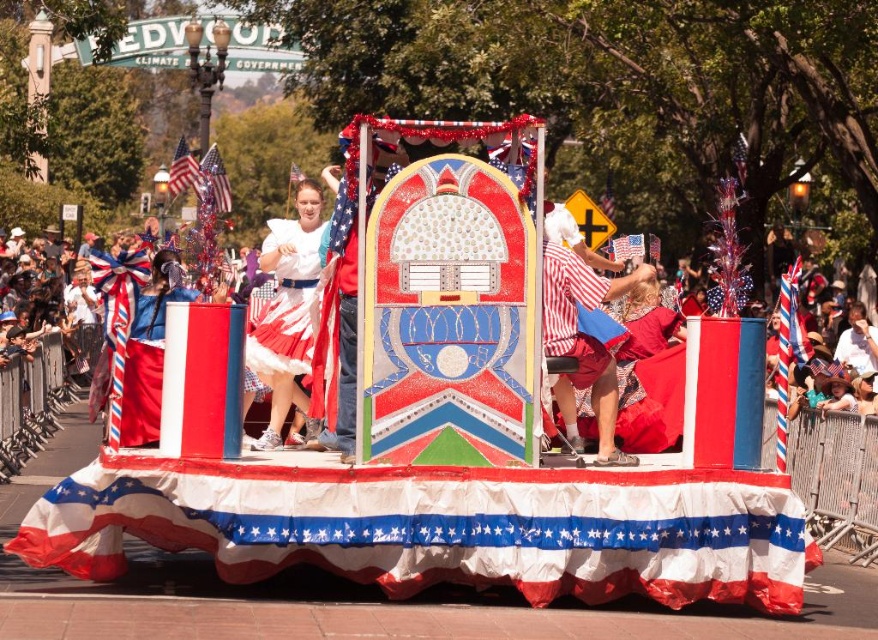
You are a photographer standing in the crowd at the parade. You want to capture a photo of the float with the shiny metallic flag at upper left in the frame. Where should you position yourself relative to the float to ensure the flag is visible?

To capture the shiny metallic flag at upper left in your photo, position yourself to the left side of the float so that the flag at the upper left corner is within your camera frame.

You are a photographer at the parade and want to capture both the shiny metallic flag at upper left and the red fabric flag at upper left in a single shot. Which flag should you focus on first to ensure both are in frame?

The shiny metallic flag at upper left is smaller in size compared to the red fabric flag at upper left. To ensure both are in frame, focus on the larger red fabric flag at upper left first, then adjust the shot to include the smaller shiny metallic flag at upper left.